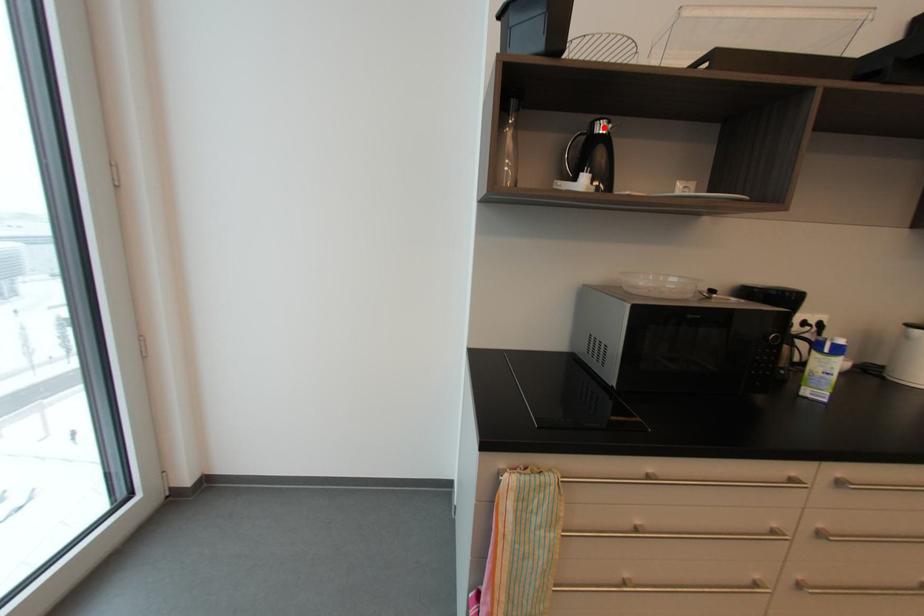
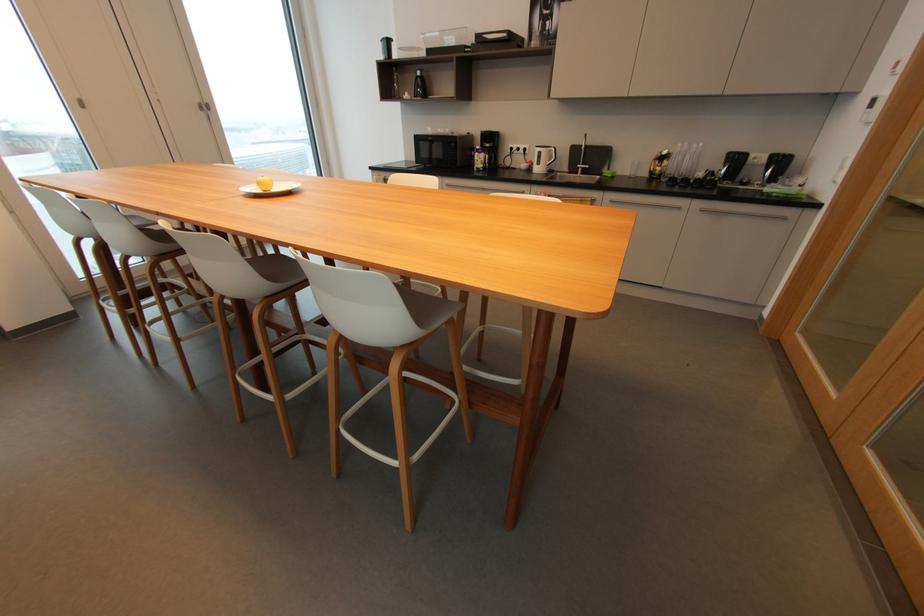
In the second image, find the point that corresponds to the highlighted location in the first image.

(421, 74)